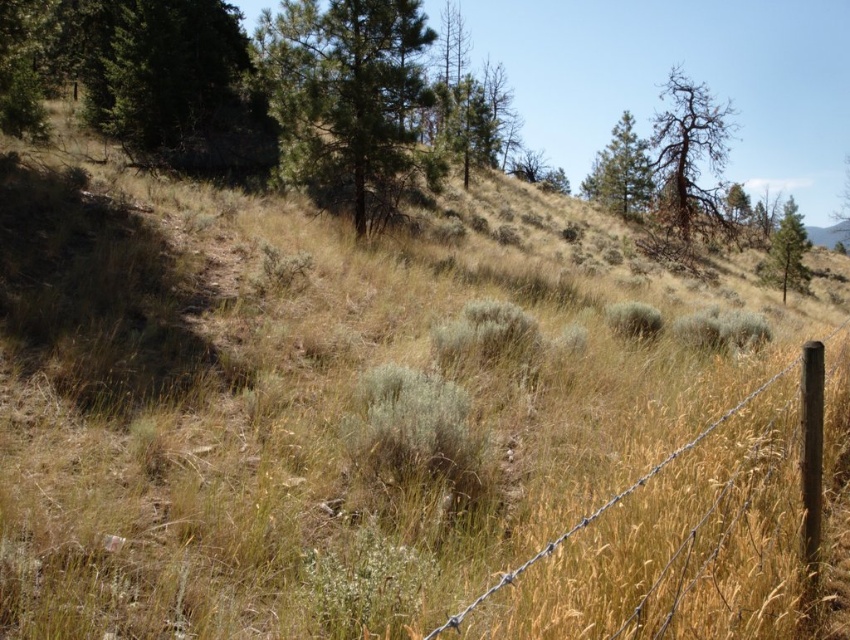
Question: Where is brown textured tree at upper right located in relation to brown wire fence at lower right in the image?

Choices:
 (A) right
 (B) left

Answer: (A)

Question: Is brown textured tree at upper right positioned behind green leafy tree at upper right?

Choices:
 (A) no
 (B) yes

Answer: (B)

Question: Estimate the real-world distances between objects in this image. Which object is closer to the green textured pine tree at upper right?

Choices:
 (A) green textured pine tree at upper center
 (B) green leafy tree at upper right
 (C) brown textured tree at upper right

Answer: (C)

Question: Can you confirm if green textured pine tree at upper center is thinner than brown wire fence at lower right?

Choices:
 (A) yes
 (B) no

Answer: (A)

Question: Which point is closer to the camera?

Choices:
 (A) (630, 177)
 (B) (697, 161)

Answer: (B)

Question: Based on their relative distances, which object is nearer to the green textured pine tree at upper right?

Choices:
 (A) brown textured tree at upper right
 (B) green textured pine tree at upper center
 (C) brown wire fence at lower right

Answer: (A)